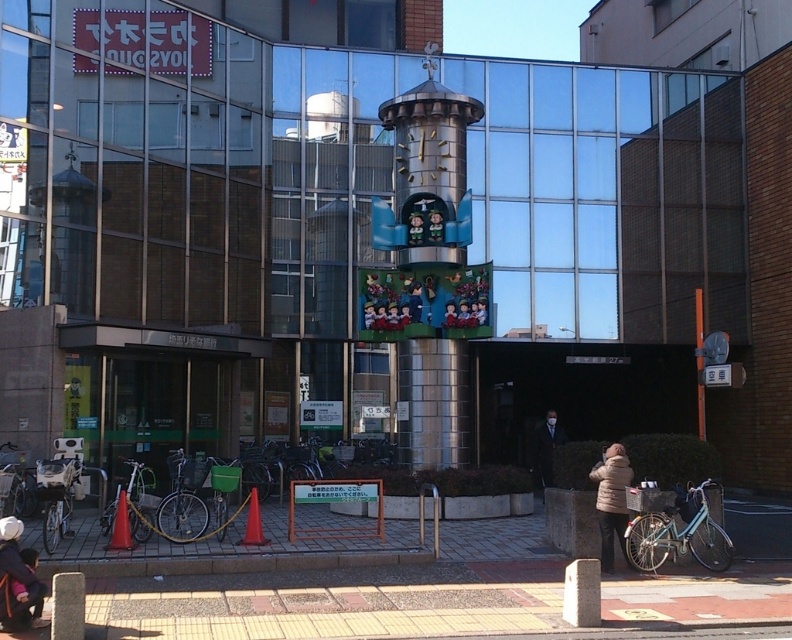
You are a delivery person standing at the entrance of the building. You need to place a package on the ground near the matte black jacket at lower left. Based on the coordinates provided, can you confirm the exact location to place the package?

The matte black jacket at lower left is located at coordinates point [18,580], so you should place the package near that point.